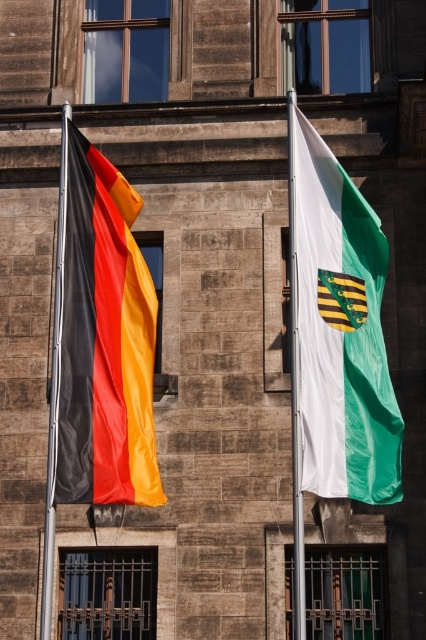
You are standing in front of a stone building and see the matte fabric flag at left and the white fabric flag at right. Which flag is closer to the left edge of the building?

The matte fabric flag at left is closer to the left edge of the building because it is positioned on the left side of the white fabric flag at right.

You are standing in front of a stone building with two flags. You want to take a photo of the matte fabric flag at left and the white fabric flag at right. Which flag should you focus on first to ensure both are in the frame?

You should focus on the matte fabric flag at left first because it is closer to you than the white fabric flag at right, ensuring both are in the frame.